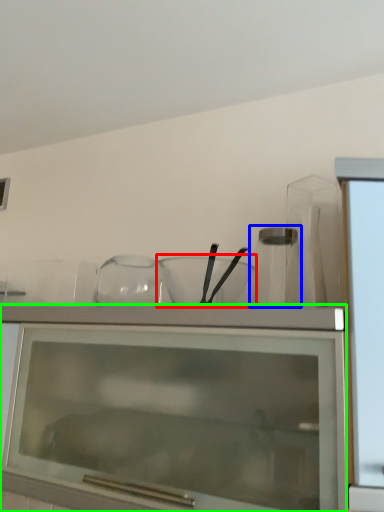
Question: Considering the real-world distances, which object is farthest from mixing bowl (highlighted by a red box)? glass vase (highlighted by a blue box) or cabinetry (highlighted by a green box)?

Choices:
 (A) glass vase
 (B) cabinetry

Answer: (B)